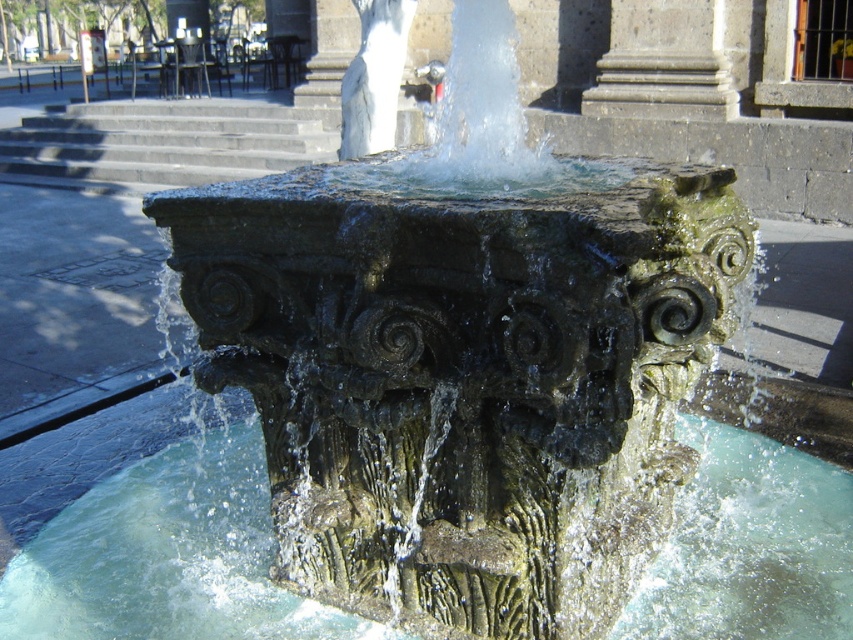
You are standing at the base of the fountain and see the point marked at coordinates (167, 556). Based on the scene description, where is this point located in relation to the fountain?

The point at coordinates (167, 556) is located on the green mossy stone water at center.